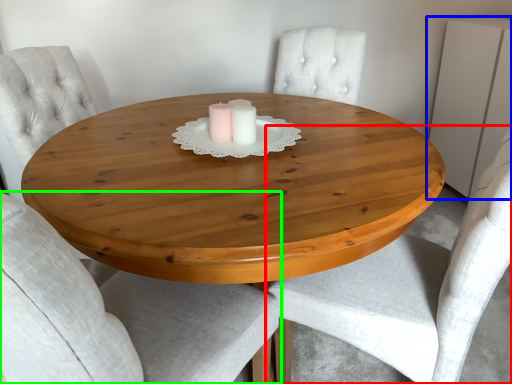
Question: Which object is the closest to the chair (highlighted by a red box)? Choose among these: dresser (highlighted by a blue box) or chair (highlighted by a green box).

Choices:
 (A) dresser
 (B) chair

Answer: (B)